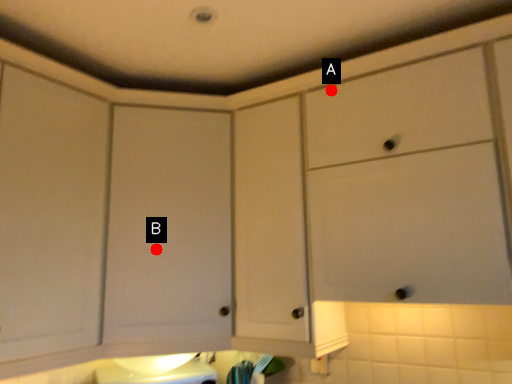
Question: Two points are circled on the image, labeled by A and B beside each circle. Which point is closer to the camera taking this photo?

Choices:
 (A) A is closer
 (B) B is closer

Answer: (A)